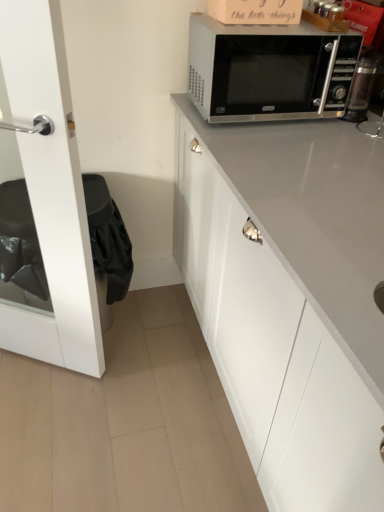
Measure the distance between satin silver microwave at upper right and camera.

satin silver microwave at upper right and camera are 3.83 feet apart from each other.

You are a GUI agent. You are given a task and a screenshot of the screen. Output one action in this format:
    pyautogui.click(x=<x>, y=<y>)
    Task: Click on the satin silver microwave at upper right
    This screenshot has height=512, width=384.
    Given the screenshot: What is the action you would take?
    pyautogui.click(x=269, y=71)

Describe the element at coordinates (269, 71) in the screenshot. I see `satin silver microwave at upper right` at that location.

Describe the element at coordinates (50, 192) in the screenshot. I see `white glossy door at left` at that location.

Locate an element on the screen. The height and width of the screenshot is (512, 384). white glossy door at left is located at coordinates (50, 192).

This screenshot has height=512, width=384. In order to click on satin silver microwave at upper right in this screenshot , I will do `click(269, 71)`.

Is satin silver microwave at upper right to the left of white glossy door at left from the viewer's perspective?

In fact, satin silver microwave at upper right is to the right of white glossy door at left.

In the image, is satin silver microwave at upper right positioned in front of or behind white glossy door at left?

satin silver microwave at upper right is behind white glossy door at left.

Is point (196, 57) more distant than point (2, 29)?

Yes, point (196, 57) is farther from viewer.

From the image's perspective, is satin silver microwave at upper right beneath white glossy door at left?

No, from the image's perspective, satin silver microwave at upper right is not beneath white glossy door at left.

From a real-world perspective, is satin silver microwave at upper right above or below white glossy door at left?

satin silver microwave at upper right is above white glossy door at left.

Can you confirm if satin silver microwave at upper right is thinner than white glossy door at left?

Incorrect, the width of satin silver microwave at upper right is not less than that of white glossy door at left.

From their relative heights in the image, would you say satin silver microwave at upper right is taller or shorter than white glossy door at left?

In the image, satin silver microwave at upper right appears to be shorter than white glossy door at left.

Who is bigger, satin silver microwave at upper right or white glossy door at left?

white glossy door at left is bigger.

Is satin silver microwave at upper right located outside white glossy door at left?

satin silver microwave at upper right lies outside white glossy door at left's area.

Is there a large distance between satin silver microwave at upper right and white glossy door at left?

They are positioned close to each other.

Is satin silver microwave at upper right facing towards white glossy door at left?

No, satin silver microwave at upper right is not facing towards white glossy door at left.

Locate an element on the screen. Image resolution: width=384 pixels, height=512 pixels. glass door on the left of satin silver microwave at upper right is located at coordinates (50, 192).

Which is more to the right, white glossy door at left or satin silver microwave at upper right?

satin silver microwave at upper right is more to the right.

Relative to satin silver microwave at upper right, is white glossy door at left in front or behind?

Visually, white glossy door at left is located in front of satin silver microwave at upper right.

Which is behind, point (81, 364) or point (318, 82)?

Positioned behind is point (81, 364).

From the image's perspective, who appears lower, white glossy door at left or satin silver microwave at upper right?

From the image's view, white glossy door at left is below.

From a real-world perspective, is white glossy door at left on top of satin silver microwave at upper right?

No.

Which object is thinner, white glossy door at left or satin silver microwave at upper right?

With smaller width is white glossy door at left.

Considering the sizes of objects white glossy door at left and satin silver microwave at upper right in the image provided, who is taller, white glossy door at left or satin silver microwave at upper right?

white glossy door at left is taller.

Can you confirm if white glossy door at left is bigger than satin silver microwave at upper right?

Correct, white glossy door at left is larger in size than satin silver microwave at upper right.

Is white glossy door at left spatially inside satin silver microwave at upper right, or outside of it?

The correct answer is: outside.

Are white glossy door at left and satin silver microwave at upper right beside each other?

They are not placed beside each other.

From the picture: Is white glossy door at left oriented away from satin silver microwave at upper right?

No, white glossy door at left's orientation is not away from satin silver microwave at upper right.

The height and width of the screenshot is (512, 384). Identify the location of microwave oven that is above the white glossy door at left (from a real-world perspective). pos(269,71).

I want to click on microwave oven that is on the right side of white glossy door at left, so click(269, 71).

What are the coordinates of `glass door in front of the satin silver microwave at upper right` in the screenshot? It's located at (50, 192).